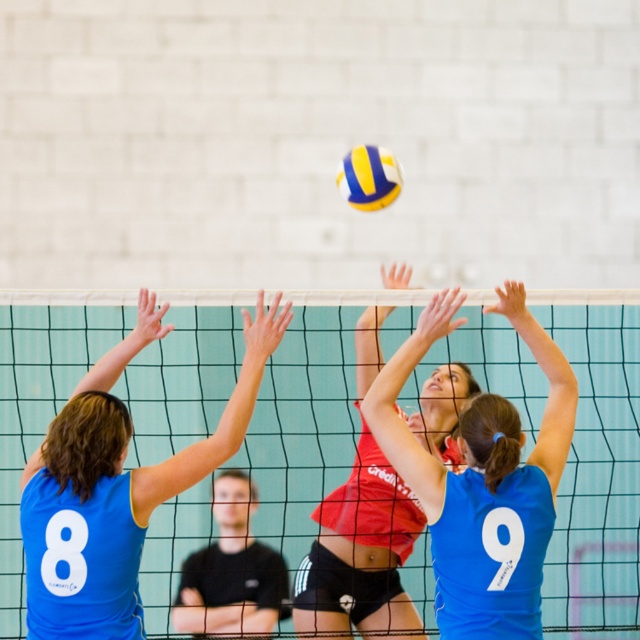
You are a photographer standing behind the volleyball net. You want to take a photo of the red jersey volleyball player at center and the red jersey at center. Which one is positioned to the right side of the other?

The red jersey volleyball player at center is to the right of the red jersey at center.

Consider the image. You are a photographer standing behind the red jersey volleyball player at center. You want to capture a photo of the green mesh net at center without the player blocking the view. Is the net large enough to be fully visible in the photo?

The green mesh net at center has a larger size compared to red jersey volleyball player at center, so yes, the net is large enough to be fully visible in the photo without the player blocking the view.